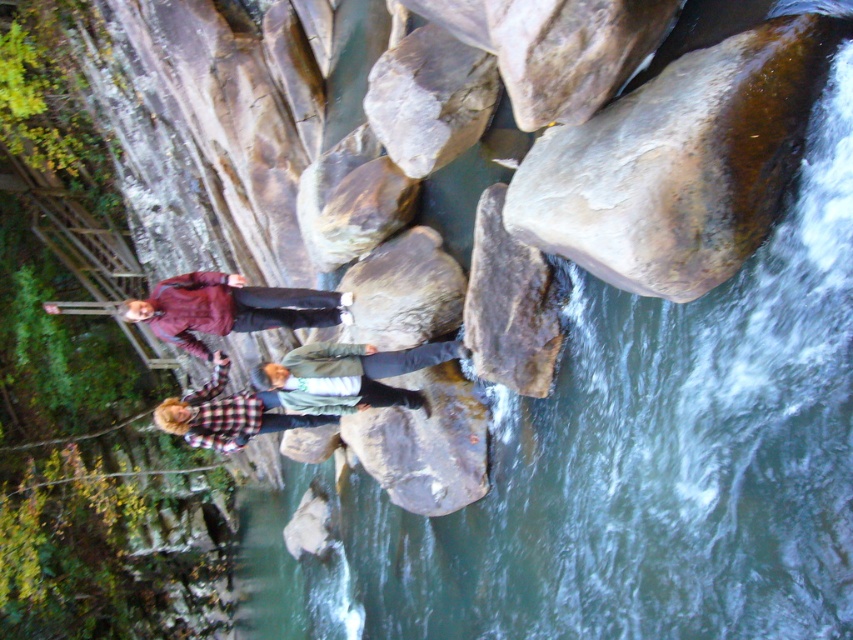
Is smooth brown rock at center shorter than maroon fabric jacket at upper left?

Incorrect, smooth brown rock at center's height does not fall short of maroon fabric jacket at upper left's.

Does point (479, 276) lie behind point (167, 301)?

That is False.

Measure the distance between point (503, 232) and camera.

They are 8.51 meters apart.

You are a GUI agent. You are given a task and a screenshot of the screen. Output one action in this format:
    pyautogui.click(x=<x>, y=<y>)
    Task: Click on the smooth brown rock at center
    
    Given the screenshot: What is the action you would take?
    pyautogui.click(x=508, y=305)

Is smooth brown rock at center in front of rough gray rock at center?

Yes, it is in front of rough gray rock at center.

Is point (480, 333) positioned behind point (360, 326)?

No, it is in front of (360, 326).

The image size is (853, 640). I want to click on smooth brown rock at center, so click(508, 305).

Is point (426, 125) farther from viewer compared to point (482, 344)?

That is True.

Which is behind, point (412, 92) or point (492, 307)?

The point (412, 92) is more distant.

Image resolution: width=853 pixels, height=640 pixels. I want to click on rough textured rock at upper center, so click(x=430, y=99).

Locate an element on the screen. The image size is (853, 640). rough textured rock at upper center is located at coordinates (430, 99).